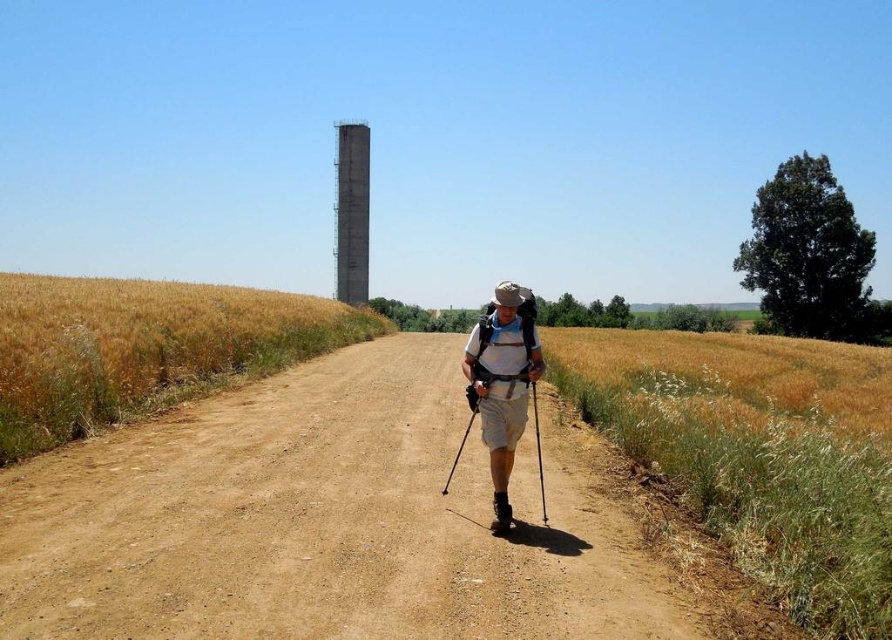
From the picture: Does golden wheat field at left have a larger size compared to concrete tower at upper center?

No, golden wheat field at left is not bigger than concrete tower at upper center.

Is point (310, 337) farther from viewer compared to point (341, 246)?

No, (310, 337) is in front of (341, 246).

Does point (233, 317) come closer to viewer compared to point (358, 141)?

Yes, point (233, 317) is in front of point (358, 141).

Locate an element on the screen. This screenshot has height=640, width=892. golden wheat field at left is located at coordinates (145, 348).

Can you confirm if golden wheat field at left is positioned to the right of matte khaki shorts at center?

Incorrect, golden wheat field at left is not on the right side of matte khaki shorts at center.

Does golden wheat field at left have a greater height compared to matte khaki shorts at center?

Correct, golden wheat field at left is much taller as matte khaki shorts at center.

Who is more distant from viewer, (170,344) or (492,461)?

The point (170,344) is behind.

Identify the location of golden wheat field at left. (145, 348).

The image size is (892, 640). Describe the element at coordinates (502, 381) in the screenshot. I see `matte khaki shorts at center` at that location.

Who is positioned more to the left, matte khaki shorts at center or concrete tower at upper center?

From the viewer's perspective, concrete tower at upper center appears more on the left side.

Does point (502, 301) lie behind point (361, 172)?

No.

Locate an element on the screen. matte khaki shorts at center is located at coordinates (502, 381).